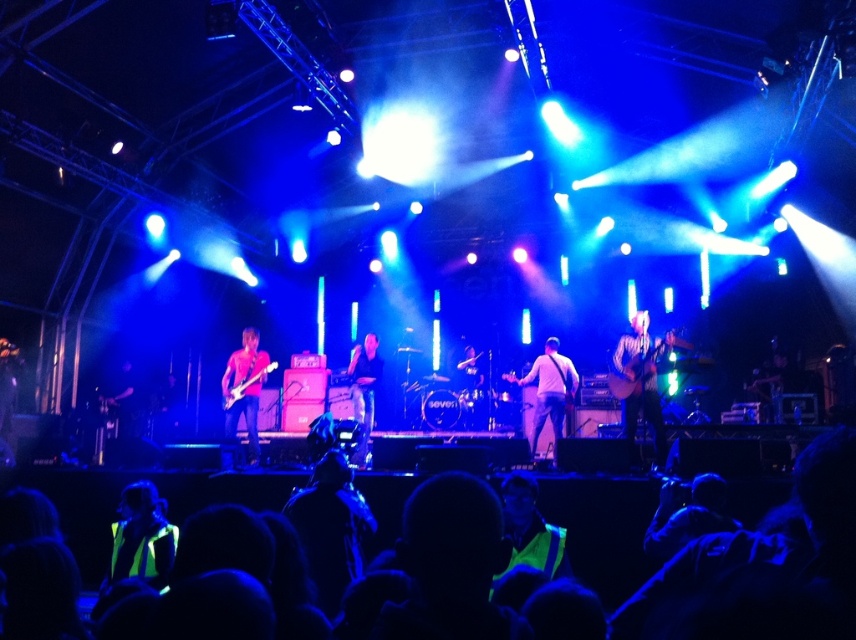
Between point (651, 422) and point (468, 344), which one is positioned behind?

The point (468, 344) is more distant.

Is point (629, 348) farther from viewer compared to point (476, 374)?

No, (629, 348) is closer to viewer.

Is point (658, 355) in front of point (476, 362)?

Yes, it is.

You are a GUI agent. You are given a task and a screenshot of the screen. Output one action in this format:
    pyautogui.click(x=<x>, y=<y>)
    Task: Click on the shiny silver guitar at right
    This screenshot has width=856, height=640.
    Given the screenshot: What is the action you would take?
    pyautogui.click(x=642, y=380)

Does shiny silver guitar at right have a smaller size compared to black leather guitar at center?

No.

Who is shorter, shiny silver guitar at right or black leather guitar at center?

shiny silver guitar at right

Does point (669, 339) come closer to viewer compared to point (370, 353)?

Yes, point (669, 339) is closer to viewer.

At what (x,y) coordinates should I click in order to perform the action: click on shiny silver guitar at right. Please return your answer as a coordinate pair (x, y). Image resolution: width=856 pixels, height=640 pixels. Looking at the image, I should click on (642, 380).

Can you confirm if pink matte guitar at center is taller than matte black guitar at center?

Correct, pink matte guitar at center is much taller as matte black guitar at center.

Measure the distance between pink matte guitar at center and camera.

They are 27.00 feet apart.

I want to click on pink matte guitar at center, so click(245, 388).

Identify the location of pink matte guitar at center. This screenshot has height=640, width=856. (245, 388).